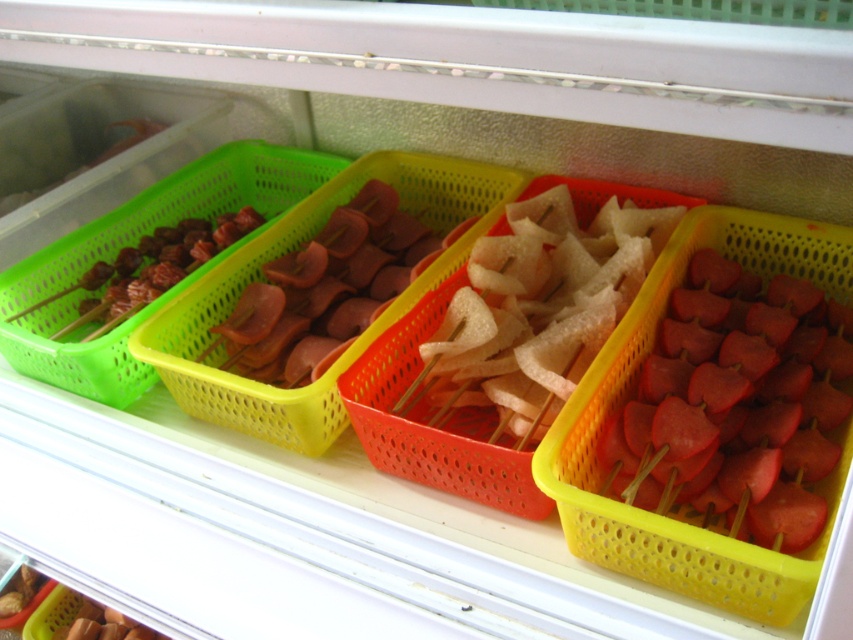
Question: Which object is positioned closest to the red matte skewers at right?

Choices:
 (A) translucent white skewers at center
 (B) pink glossy sausages at center

Answer: (A)

Question: Does translucent white skewers at center appear on the right side of green plastic skewers at left?

Choices:
 (A) yes
 (B) no

Answer: (A)

Question: Among these points, which one is farthest from the camera?

Choices:
 (A) (341, 230)
 (B) (672, 392)

Answer: (A)

Question: Does red matte skewers at right have a lesser width compared to green plastic skewers at left?

Choices:
 (A) yes
 (B) no

Answer: (A)

Question: Considering the relative positions of translucent white skewers at center and pink glossy sausages at center in the image provided, where is translucent white skewers at center located with respect to pink glossy sausages at center?

Choices:
 (A) left
 (B) right

Answer: (B)

Question: Which point is closer to the camera?

Choices:
 (A) (396, 205)
 (B) (62, 275)

Answer: (B)